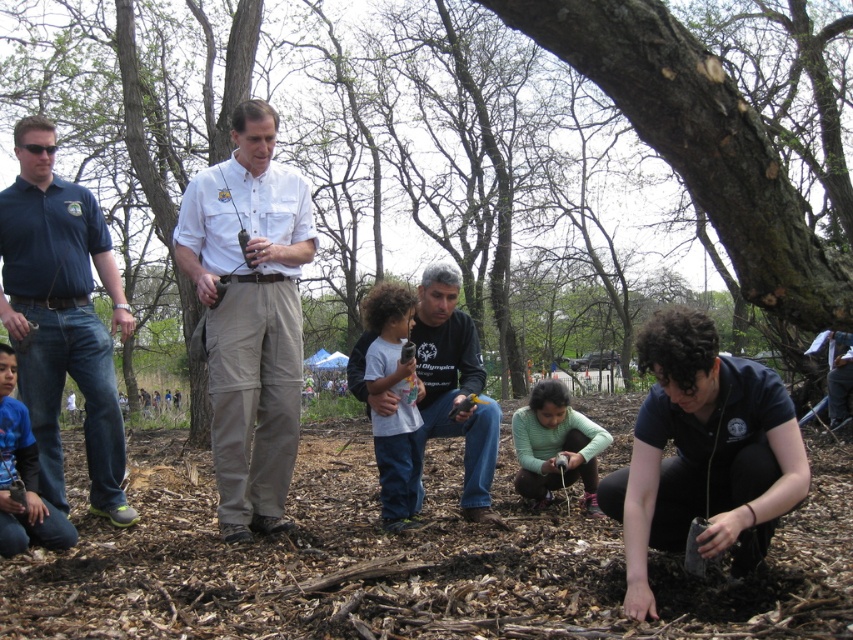
Question: Among these points, which one is nearest to the camera?

Choices:
 (A) (50, 211)
 (B) (520, 412)
 (C) (390, 285)
 (D) (193, 268)

Answer: (D)

Question: Which of the following is the closest to the observer?

Choices:
 (A) blue denim jeans at left
 (B) white cotton shirt at center
 (C) blue denim jeans at lower left

Answer: (C)

Question: Which object is positioned farthest from the blue denim jeans at lower left?

Choices:
 (A) dark blue shirt at lower right
 (B) light brown cotton shirt at center

Answer: (A)

Question: Is light brown cotton shirt at center to the right of blue denim jeans at lower left from the viewer's perspective?

Choices:
 (A) no
 (B) yes

Answer: (B)

Question: Does rough bark tree at center come in front of green knit sweater at center?

Choices:
 (A) no
 (B) yes

Answer: (B)

Question: Can you confirm if rough bark tree at center is positioned above light brown cotton shirt at center?

Choices:
 (A) no
 (B) yes

Answer: (B)